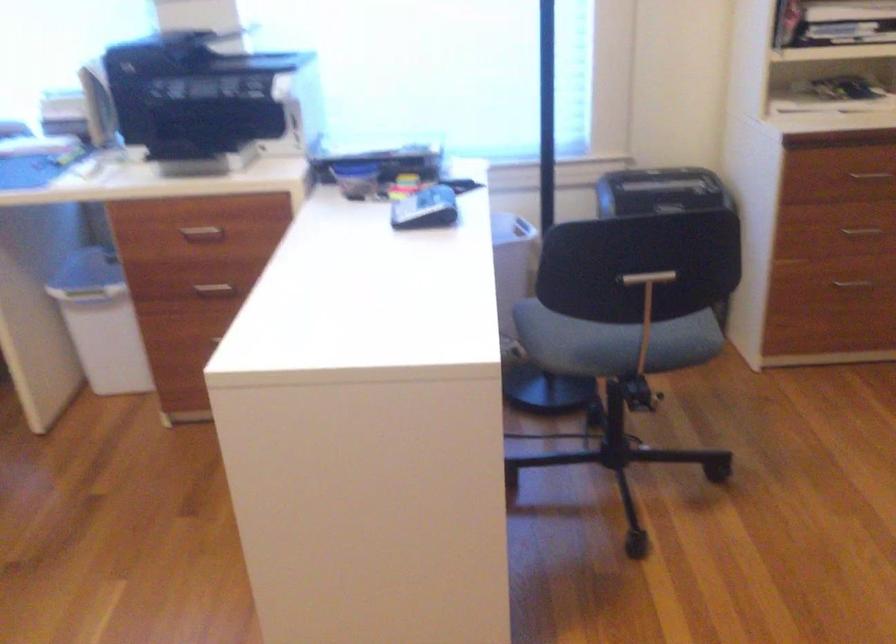
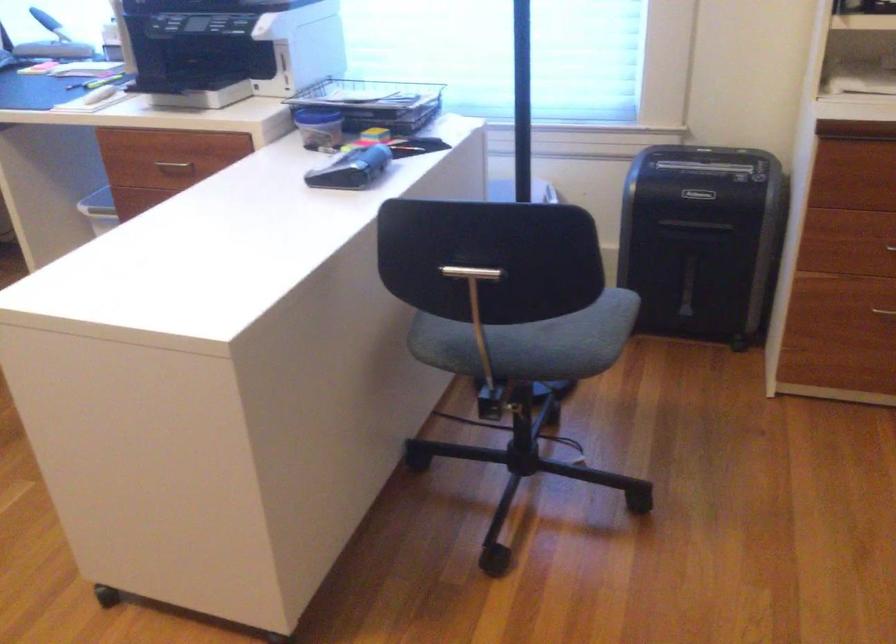
In the second image, find the point that corresponds to (x=204, y=232) in the first image.

(174, 165)